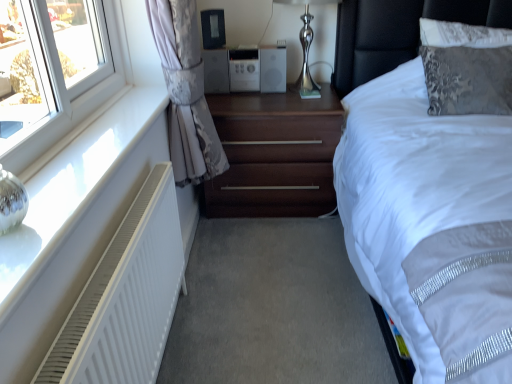
Where is `vacant space in front of silver metallic stereo at center`? The height and width of the screenshot is (384, 512). vacant space in front of silver metallic stereo at center is located at coordinates (261, 105).